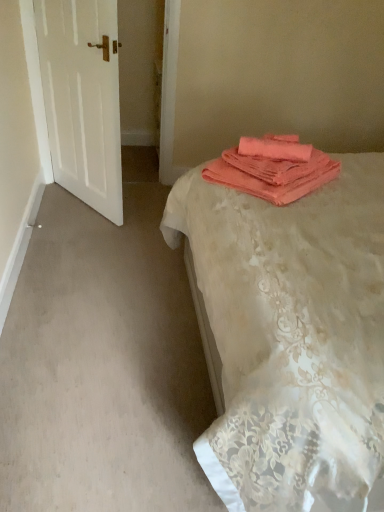
Image resolution: width=384 pixels, height=512 pixels. In order to click on space that is in front of white matte door at left in this screenshot , I will do `click(86, 236)`.